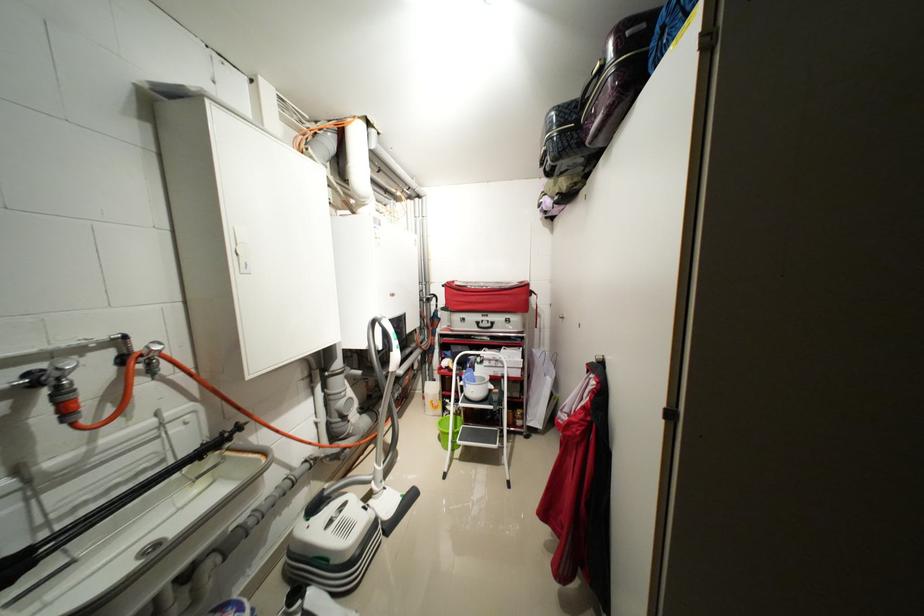
Where is `white paper bag`? white paper bag is located at coordinates (539, 387).